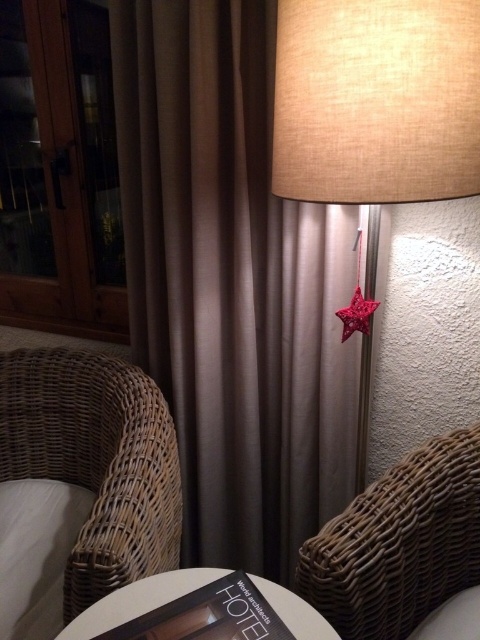
Does woven rattan armchair at lower left have a larger size compared to beige fabric lampshade at center?

No, woven rattan armchair at lower left is not bigger than beige fabric lampshade at center.

Find the location of a particular element. This screenshot has width=480, height=640. woven rattan armchair at lower left is located at coordinates (80, 484).

Can you confirm if brown wicker armchair at lower right is positioned to the right of white soft pillow at lower left?

Yes, brown wicker armchair at lower right is to the right of white soft pillow at lower left.

Who is higher up, brown wicker armchair at lower right or white soft pillow at lower left?

brown wicker armchair at lower right is above.

I want to click on brown wicker armchair at lower right, so click(398, 541).

In order to click on brown wicker armchair at lower right in this screenshot , I will do `click(398, 541)`.

Between beige fabric lampshade at center and white matte table at center, which one appears on the left side from the viewer's perspective?

From the viewer's perspective, white matte table at center appears more on the left side.

Is point (451, 42) positioned behind point (175, 586)?

That is False.

Where is `beige fabric lampshade at center`? The width and height of the screenshot is (480, 640). beige fabric lampshade at center is located at coordinates (376, 104).